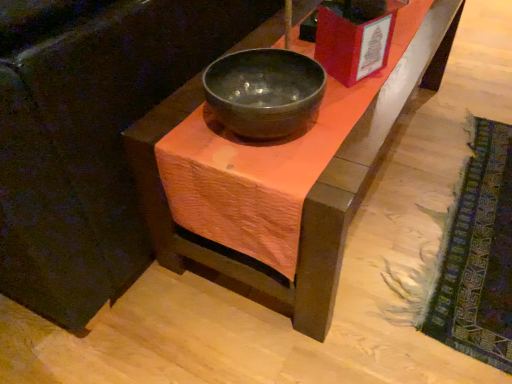
Find the location of a particular element. The image size is (512, 384). free space between matte black bowl at center and textured woolen mat at lower right is located at coordinates (412, 188).